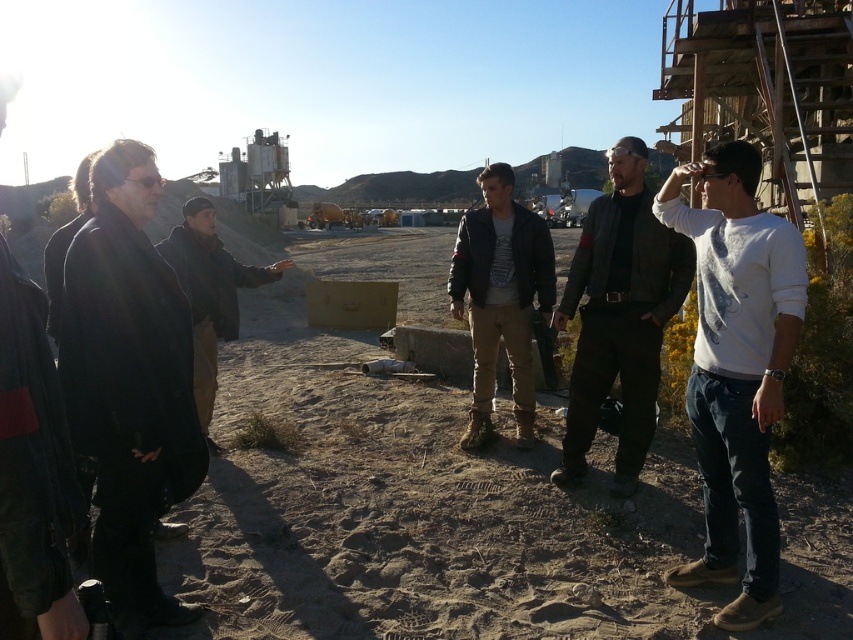
Question: Which of the following is the closest to the observer?

Choices:
 (A) dark gray leather jacket at center
 (B) white cotton shirt at right

Answer: (B)

Question: Which is nearer to the dark gray leather jacket at center?

Choices:
 (A) dark blue leather jacket at center
 (B) brown leather jacket at center
 (C) black matte jacket at left
 (D) white cotton shirt at right

Answer: (D)

Question: Considering the real-world distances, which object is closest to the black matte jacket at left?

Choices:
 (A) brown leather jacket at center
 (B) dark gray leather jacket at center

Answer: (A)

Question: Is white cotton shirt at right closer to camera compared to dark gray leather jacket at center?

Choices:
 (A) yes
 (B) no

Answer: (A)

Question: Does black matte jacket at left have a larger size compared to white cotton shirt at right?

Choices:
 (A) no
 (B) yes

Answer: (A)

Question: Does black matte jacket at left have a smaller size compared to dark blue leather jacket at center?

Choices:
 (A) yes
 (B) no

Answer: (B)